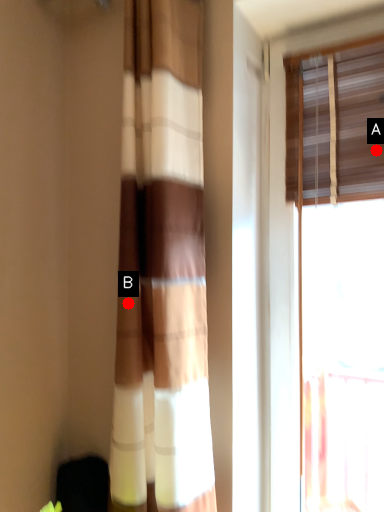
Question: Two points are circled on the image, labeled by A and B beside each circle. Which point is closer to the camera taking this photo?

Choices:
 (A) A is closer
 (B) B is closer

Answer: (B)